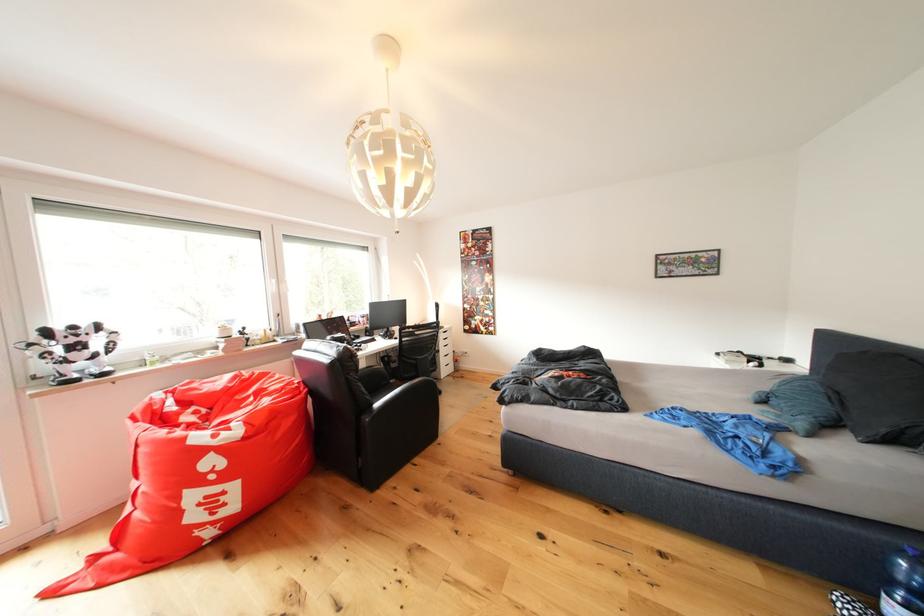
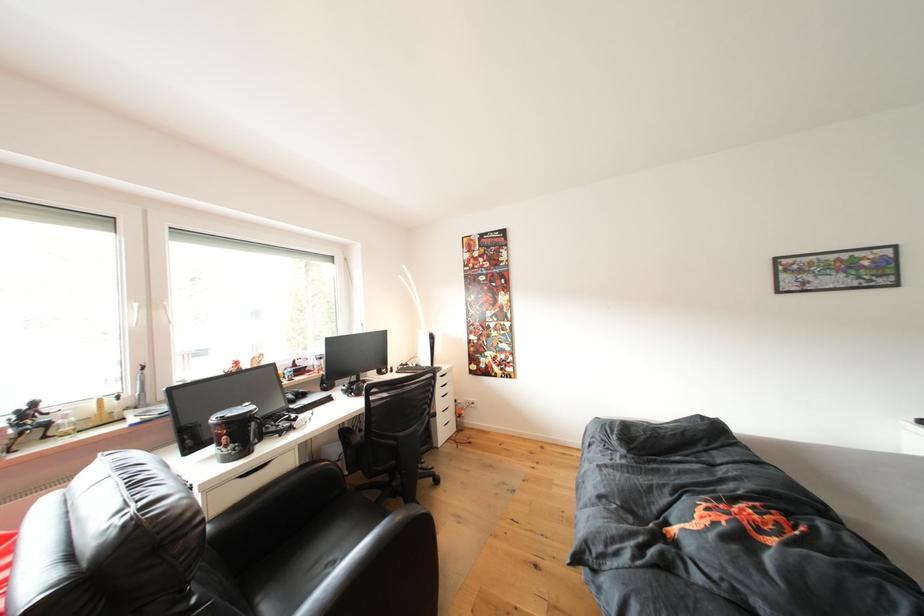
Question: The images are taken continuously from a first-person perspective. In which direction are you moving?

Choices:
 (A) Left
 (B) Right
 (C) Forward
 (D) Backward

Answer: (C)